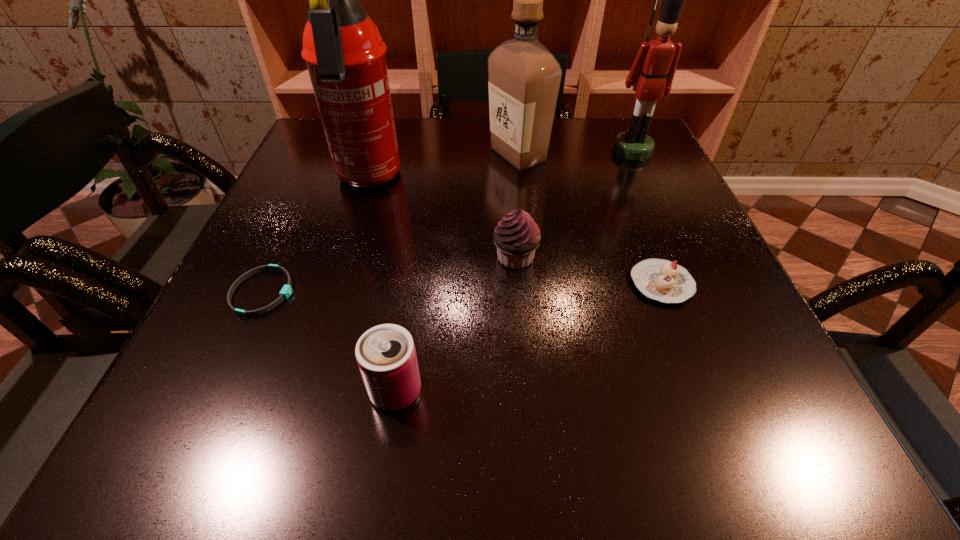
At what (x,y) coordinates should I click in order to perform the action: click on vacant area that lies between the nutcracker and the right cupcake. Please return your answer as a coordinate pair (x, y). This screenshot has width=960, height=540. Looking at the image, I should click on (647, 217).

At what (x,y) coordinates should I click in order to perform the action: click on vacant area that lies between the left cupcake and the nearest object. Please return your answer as a coordinate pair (x, y). This screenshot has height=540, width=960. Looking at the image, I should click on (456, 324).

At what (x,y) coordinates should I click in order to perform the action: click on free space between the nearest object and the liquor. Please return your answer as a coordinate pair (x, y). Looking at the image, I should click on (457, 273).

At what (x,y) coordinates should I click in order to perform the action: click on vacant region between the fire extinguisher and the wristband. Please return your answer as a coordinate pair (x, y). Looking at the image, I should click on (316, 236).

Choose which object is the fourth nearest neighbor to the right cupcake. Please provide its 2D coordinates. Your answer should be formatted as a tuple, i.e. [(x, y)], where the tuple contains the x and y coordinates of a point satisfying the conditions above.

[(386, 356)]

Where is `object that stands as the closest to the sixth tallest object`? object that stands as the closest to the sixth tallest object is located at coordinates (517, 236).

I want to click on vacant area that satisfies the following two spatial constraints: 1. on the back side of the can; 2. on the right side of the taller cupcake, so click(x=416, y=257).

Where is `vacant position in the image that satisfies the following two spatial constraints: 1. on the front-facing side of the nutcracker; 2. on the front-facing side of the liquor`? The height and width of the screenshot is (540, 960). vacant position in the image that satisfies the following two spatial constraints: 1. on the front-facing side of the nutcracker; 2. on the front-facing side of the liquor is located at coordinates (635, 155).

Identify the location of free space that satisfies the following two spatial constraints: 1. on the back side of the second shortest object; 2. on the front-facing side of the liquor. This screenshot has height=540, width=960. (612, 155).

I want to click on free point that satisfies the following two spatial constraints: 1. on the front-facing side of the liquor; 2. on the back side of the sixth tallest object, so click(533, 284).